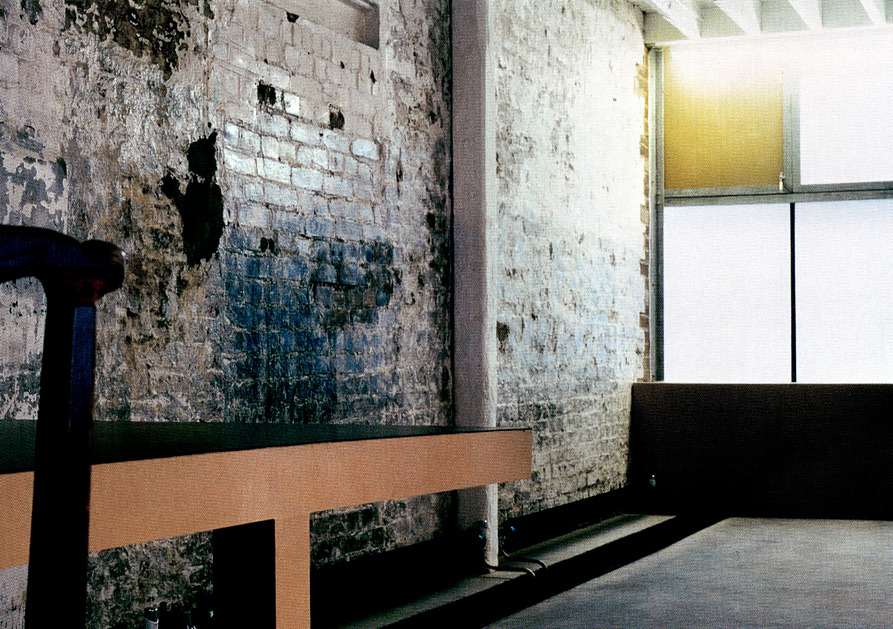
At what (x,y) coordinates should I click in order to perform the action: click on backrest of chair. Please return your answer as a coordinate pair (x, y). This screenshot has height=629, width=893. Looking at the image, I should click on coord(70,404).